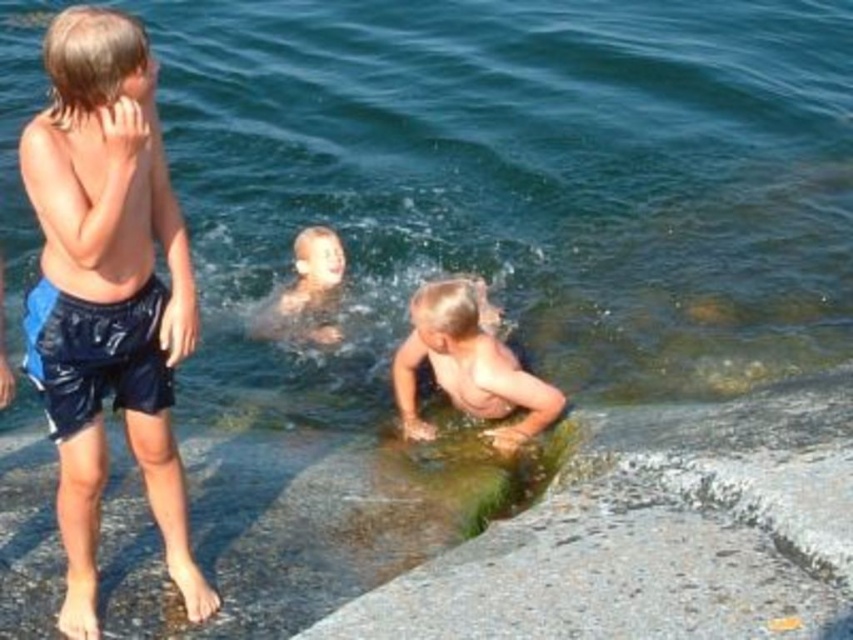
Question: Where is green mossy rock at lower center located in relation to light brown skin at lower center in the image?

Choices:
 (A) below
 (B) above

Answer: (A)

Question: Does blue shiny shorts at left lie behind light brown skin at lower center?

Choices:
 (A) yes
 (B) no

Answer: (B)

Question: Does blue shiny shorts at left lie behind light brown skin at lower center?

Choices:
 (A) yes
 (B) no

Answer: (B)

Question: Based on their relative distances, which object is nearer to the smooth skin child at center?

Choices:
 (A) green mossy rock at lower center
 (B) light brown skin at lower center
 (C) blue shiny shorts at left

Answer: (B)

Question: Which point appears closest to the camera in this image?

Choices:
 (A) (175, 328)
 (B) (294, 282)

Answer: (A)

Question: Which object is positioned closest to the blue shiny shorts at left?

Choices:
 (A) smooth skin child at center
 (B) light brown skin at lower center

Answer: (B)